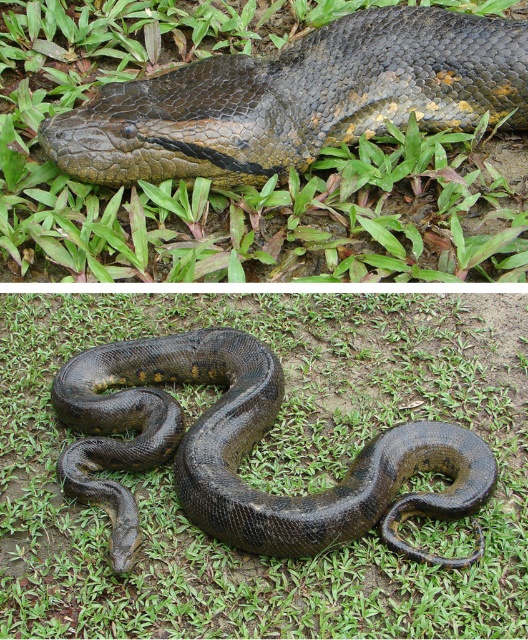
Which is more to the right, shiny dark green snake at upper center or shiny dark green snake at center?

shiny dark green snake at upper center is more to the right.

Locate an element on the screen. The height and width of the screenshot is (640, 528). shiny dark green snake at upper center is located at coordinates (296, 99).

The width and height of the screenshot is (528, 640). I want to click on shiny dark green snake at upper center, so click(x=296, y=99).

This screenshot has width=528, height=640. Find the location of `shiny dark green snake at upper center`. shiny dark green snake at upper center is located at coordinates (296, 99).